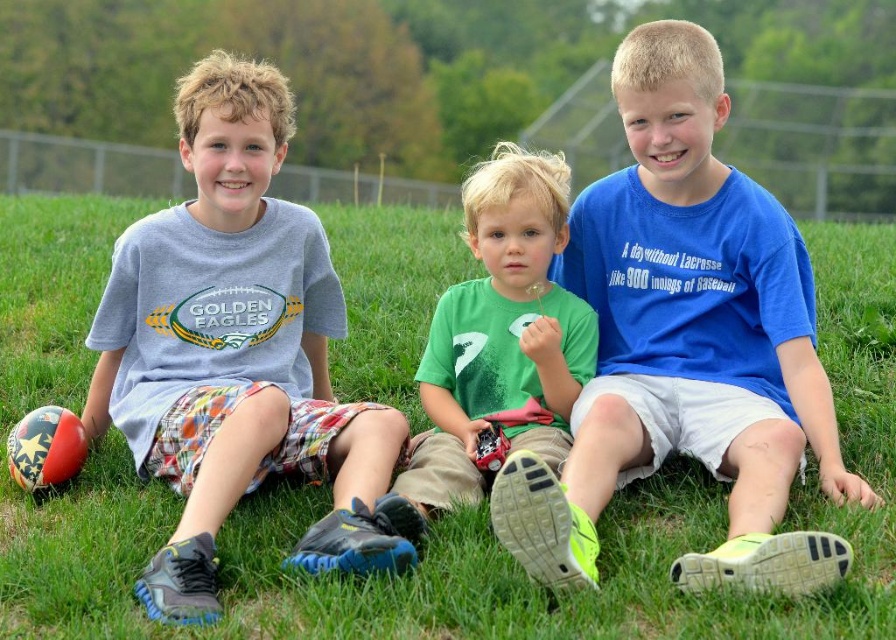
Question: Can you confirm if matte gray t-shirt at center is positioned to the left of green matte shirt at center?

Choices:
 (A) yes
 (B) no

Answer: (A)

Question: Which point is farther to the camera?

Choices:
 (A) green grass at center
 (B) blue fabric shirt at center
 (C) green matte shirt at center
 (D) matte gray t-shirt at center

Answer: (A)

Question: Is matte gray t-shirt at center to the right of green matte shirt at center from the viewer's perspective?

Choices:
 (A) no
 (B) yes

Answer: (A)

Question: Does green grass at center have a smaller size compared to blue fabric shirt at center?

Choices:
 (A) yes
 (B) no

Answer: (A)

Question: Which of the following is the closest to the observer?

Choices:
 (A) green grass at center
 (B) blue fabric shirt at center
 (C) matte gray t-shirt at center

Answer: (B)

Question: Which object is positioned closest to the blue fabric shirt at center?

Choices:
 (A) green matte shirt at center
 (B) green grass at center
 (C) matte gray t-shirt at center

Answer: (A)